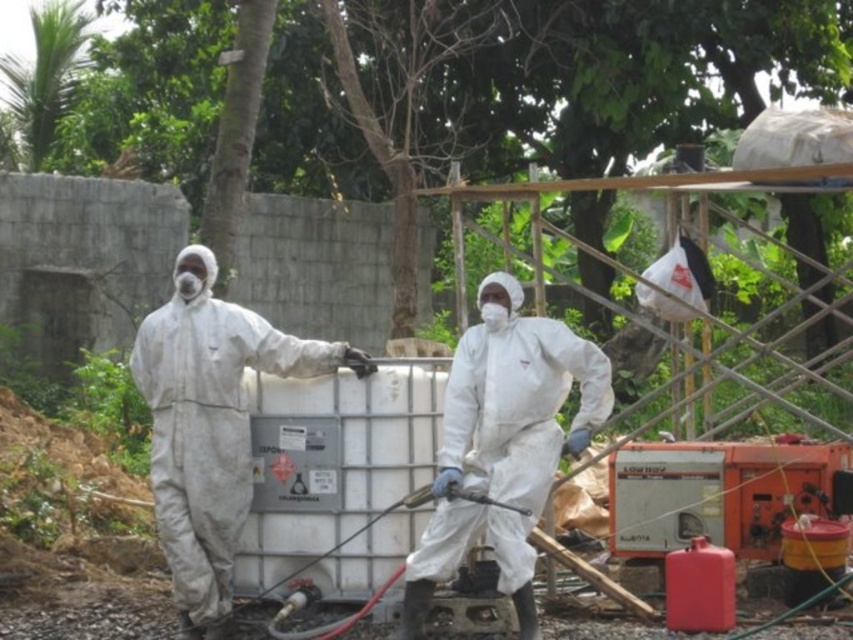
Does white matte/soft hazmat suit at left have a greater height compared to white matte/soft suit at center?

Indeed, white matte/soft hazmat suit at left has a greater height compared to white matte/soft suit at center.

Which is below, white matte/soft hazmat suit at left or white matte/soft suit at center?

Positioned lower is white matte/soft suit at center.

Describe the element at coordinates (210, 428) in the screenshot. I see `white matte/soft hazmat suit at left` at that location.

The width and height of the screenshot is (853, 640). Identify the location of white matte/soft hazmat suit at left. (210, 428).